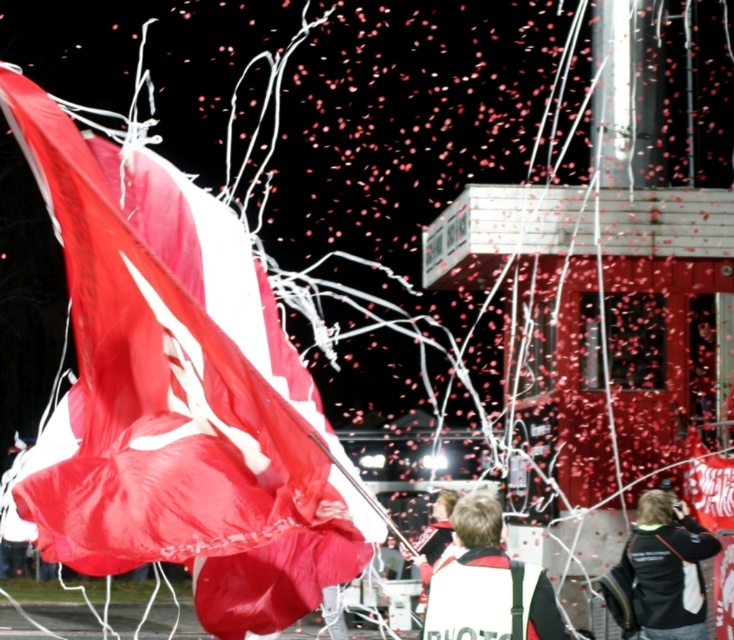
Which of these two, matte red flag at left or white fabric vest at center, stands shorter?

white fabric vest at center is shorter.

Is matte red flag at left bigger than white fabric vest at center?

Correct, matte red flag at left is larger in size than white fabric vest at center.

Does point (268, 518) lie in front of point (508, 580)?

That is True.

Find the location of a particular element. This screenshot has height=640, width=734. matte red flag at left is located at coordinates (178, 397).

Between matte red flag at left and black fabric jacket at lower right, which one has more height?

With more height is matte red flag at left.

Between matte red flag at left and black fabric jacket at lower right, which one has less height?

black fabric jacket at lower right

Looking at this image, who is more forward, (265, 492) or (653, 595)?

Point (265, 492)

Identify the location of matte red flag at left. (178, 397).

Is white fabric vest at center shorter than black fabric jacket at lower right?

Correct, white fabric vest at center is not as tall as black fabric jacket at lower right.

This screenshot has width=734, height=640. What are the coordinates of `white fabric vest at center` in the screenshot? It's located at (487, 584).